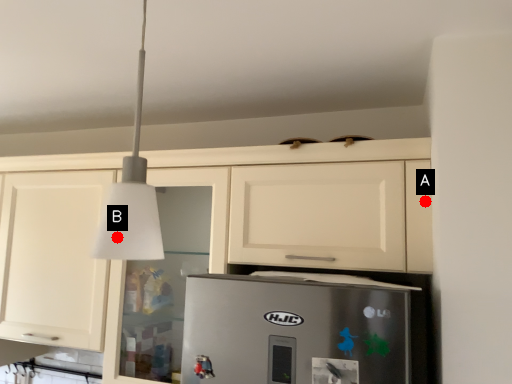
Question: Two points are circled on the image, labeled by A and B beside each circle. Which point is farther to the camera?

Choices:
 (A) A is further
 (B) B is further

Answer: (A)